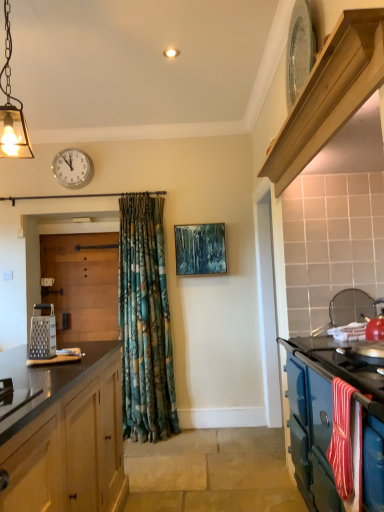
Question: Does light wood/texture shelf at upper right appear on the right side of textured blue painting at center?

Choices:
 (A) no
 (B) yes

Answer: (B)

Question: Is light wood/texture shelf at upper right facing away from textured blue painting at center?

Choices:
 (A) yes
 (B) no

Answer: (B)

Question: Considering the relative sizes of light wood/texture shelf at upper right and textured blue painting at center in the image provided, is light wood/texture shelf at upper right bigger than textured blue painting at center?

Choices:
 (A) yes
 (B) no

Answer: (A)

Question: Considering the relative sizes of light wood/texture shelf at upper right and textured blue painting at center in the image provided, is light wood/texture shelf at upper right wider than textured blue painting at center?

Choices:
 (A) no
 (B) yes

Answer: (B)

Question: Is light wood/texture shelf at upper right further to the viewer compared to textured blue painting at center?

Choices:
 (A) yes
 (B) no

Answer: (B)

Question: Is light wood/texture shelf at upper right far from textured blue painting at center?

Choices:
 (A) yes
 (B) no

Answer: (A)

Question: Is light wood/texture shelf at upper right further to camera compared to wooden door at left?

Choices:
 (A) no
 (B) yes

Answer: (A)

Question: Is light wood/texture shelf at upper right closer to the viewer compared to wooden door at left?

Choices:
 (A) yes
 (B) no

Answer: (A)

Question: Is light wood/texture shelf at upper right outside wooden door at left?

Choices:
 (A) no
 (B) yes

Answer: (B)

Question: Is light wood/texture shelf at upper right bigger than wooden door at left?

Choices:
 (A) yes
 (B) no

Answer: (B)

Question: Is wooden door at left at the back of light wood/texture shelf at upper right?

Choices:
 (A) yes
 (B) no

Answer: (B)

Question: Does light wood/texture shelf at upper right have a lesser width compared to wooden door at left?

Choices:
 (A) yes
 (B) no

Answer: (B)

Question: From the image's perspective, does metallic grater at left appear higher than light wood/texture shelf at upper right?

Choices:
 (A) yes
 (B) no

Answer: (B)